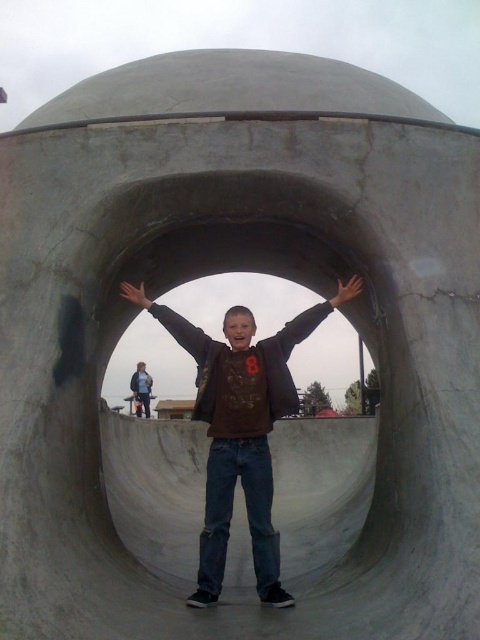
Question: Estimate the real-world distances between objects in this image. Which object is closer to the matte brown sweatshirt at center?

Choices:
 (A) light brown leather hand at center
 (B) black matte arm at center
 (C) matte black arm at center

Answer: (C)

Question: Which point is farther from the camera taking this photo?

Choices:
 (A) (343, 300)
 (B) (189, 348)
 (C) (140, 298)
 (D) (333, 296)

Answer: (D)

Question: Which object appears closest to the camera in this image?

Choices:
 (A) black matte arm at center
 (B) black matte hand at center
 (C) matte black arm at center

Answer: (A)

Question: Is light brown leather hand at center to the right of black matte hand at center from the viewer's perspective?

Choices:
 (A) no
 (B) yes

Answer: (B)

Question: Does matte brown sweatshirt at center have a greater width compared to black matte hand at center?

Choices:
 (A) no
 (B) yes

Answer: (B)

Question: Is matte brown sweatshirt at center closer to camera compared to matte black arm at center?

Choices:
 (A) yes
 (B) no

Answer: (A)